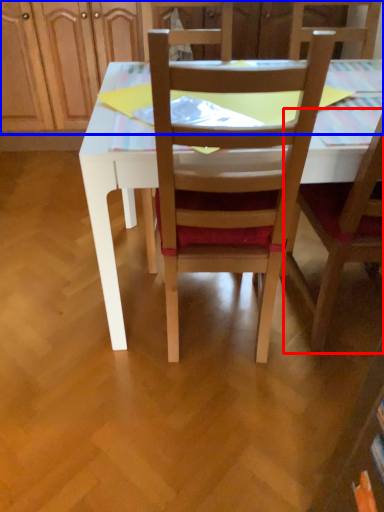
Question: Which object is further to the camera taking this photo, chair (highlighted by a red box) or dresser (highlighted by a blue box)?

Choices:
 (A) chair
 (B) dresser

Answer: (B)